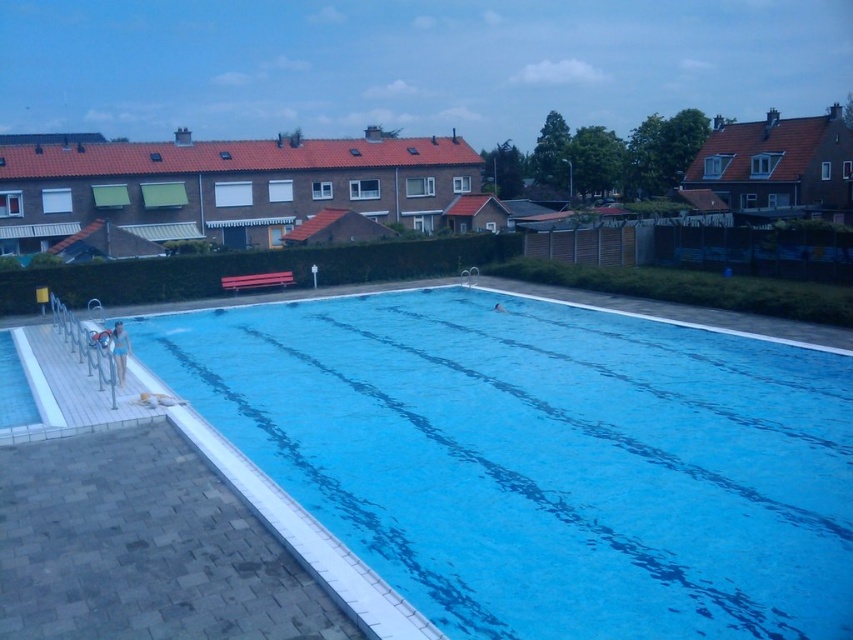
Question: Is blue smooth water at center thinner than matte blue swimsuit at lower left?

Choices:
 (A) yes
 (B) no

Answer: (B)

Question: Among these points, which one is nearest to the camera?

Choices:
 (A) (109, 330)
 (B) (424, 419)

Answer: (B)

Question: Does blue smooth water at center appear on the left side of matte blue swimsuit at lower left?

Choices:
 (A) no
 (B) yes

Answer: (A)

Question: Which object is closer to the camera taking this photo?

Choices:
 (A) matte blue swimsuit at lower left
 (B) blue smooth water at center

Answer: (B)

Question: Is blue smooth water at center above matte blue swimsuit at lower left?

Choices:
 (A) no
 (B) yes

Answer: (A)

Question: Which point is closer to the camera?

Choices:
 (A) (122, 358)
 (B) (257, 381)

Answer: (A)